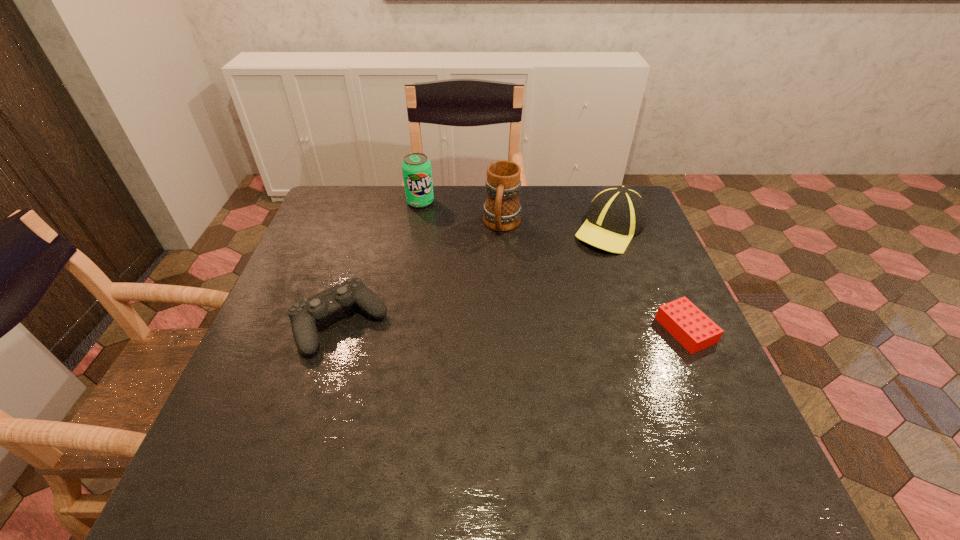
You are a GUI agent. You are given a task and a screenshot of the screen. Output one action in this format:
    pyautogui.click(x=<x>, y=<y>)
    Task: Click on the vacant space on the desktop that is between the control and the shortest object and is positioned with the brim of the baseball cap facing forward
    
    Given the screenshot: What is the action you would take?
    pyautogui.click(x=484, y=326)

I want to click on vacant space on the desktop that is between the fourth tallest object and the Lego and is positioned on the front-facing side of the pop soda, so click(511, 326).

Where is `free space on the desktop that is between the control and the shortest object and is positioned on the side of the mug with the handle`? This screenshot has width=960, height=540. free space on the desktop that is between the control and the shortest object and is positioned on the side of the mug with the handle is located at coordinates (478, 326).